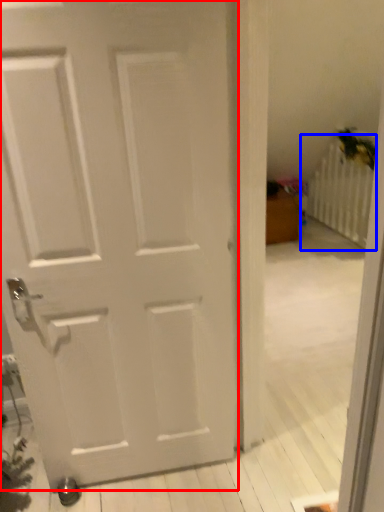
Question: Which point is closer to the camera, door (highlighted by a red box) or radiator (highlighted by a blue box)?

Choices:
 (A) door
 (B) radiator

Answer: (A)